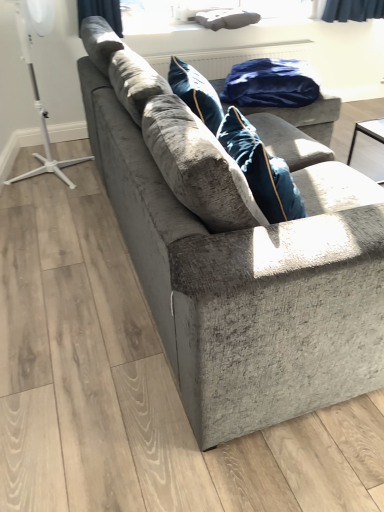
Question: From a real-world perspective, is blue velvet blanket at upper center on top of transparent glass window screen at upper center?

Choices:
 (A) yes
 (B) no

Answer: (B)

Question: Can you confirm if blue velvet blanket at upper center is taller than transparent glass window screen at upper center?

Choices:
 (A) no
 (B) yes

Answer: (A)

Question: Does blue velvet blanket at upper center appear on the left side of transparent glass window screen at upper center?

Choices:
 (A) no
 (B) yes

Answer: (A)

Question: Could transparent glass window screen at upper center be considered to be inside blue velvet blanket at upper center?

Choices:
 (A) no
 (B) yes

Answer: (A)

Question: Is blue velvet blanket at upper center beside transparent glass window screen at upper center?

Choices:
 (A) no
 (B) yes

Answer: (A)

Question: Is blue velvet blanket at upper center outside transparent glass window screen at upper center?

Choices:
 (A) no
 (B) yes

Answer: (B)

Question: Does transparent glass window screen at upper center have a larger size compared to velvet gray couch at center?

Choices:
 (A) yes
 (B) no

Answer: (B)

Question: Does transparent glass window screen at upper center have a lesser width compared to velvet gray couch at center?

Choices:
 (A) yes
 (B) no

Answer: (A)

Question: Is transparent glass window screen at upper center positioned behind velvet gray couch at center?

Choices:
 (A) yes
 (B) no

Answer: (A)

Question: Is transparent glass window screen at upper center turned away from velvet gray couch at center?

Choices:
 (A) no
 (B) yes

Answer: (A)

Question: Considering the relative sizes of transparent glass window screen at upper center and velvet gray couch at center in the image provided, is transparent glass window screen at upper center smaller than velvet gray couch at center?

Choices:
 (A) no
 (B) yes

Answer: (B)

Question: Considering the relative sizes of transparent glass window screen at upper center and velvet gray couch at center in the image provided, is transparent glass window screen at upper center shorter than velvet gray couch at center?

Choices:
 (A) yes
 (B) no

Answer: (A)

Question: Does velvet gray couch at center have a lesser height compared to white plastic tripod at left?

Choices:
 (A) no
 (B) yes

Answer: (B)